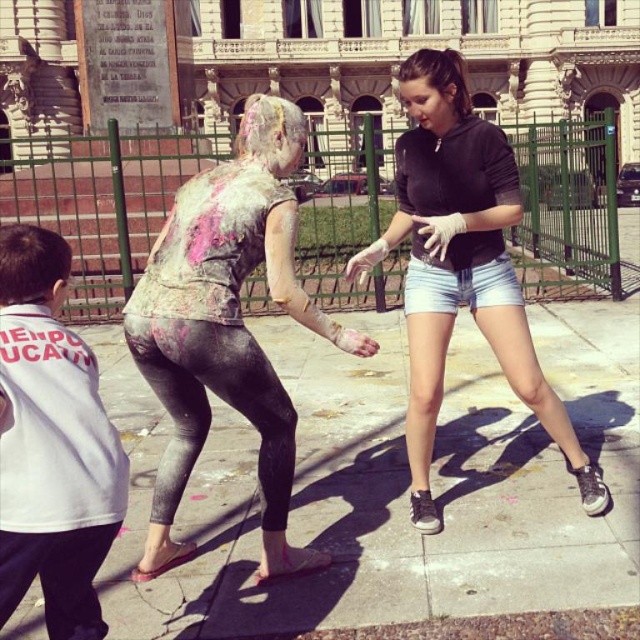
You are an observer standing in front of the scene. You see the matte black hoodie at center and the white cotton shirt at left. Which one is higher up in the image?

The matte black hoodie at center is located above the white cotton shirt at left, so it is higher up in the image.

You are standing in the plaza and want to walk to the concrete sidewalk at center. According to the coordinates provided, in which direction should you move relative to your current position?

The concrete sidewalk at center is located at coordinates point (x=394, y=484). Since coordinates are typically represented as x,y values where x increases to the right and y increases downward, you should move towards the right and downward direction to reach the concrete sidewalk at center.